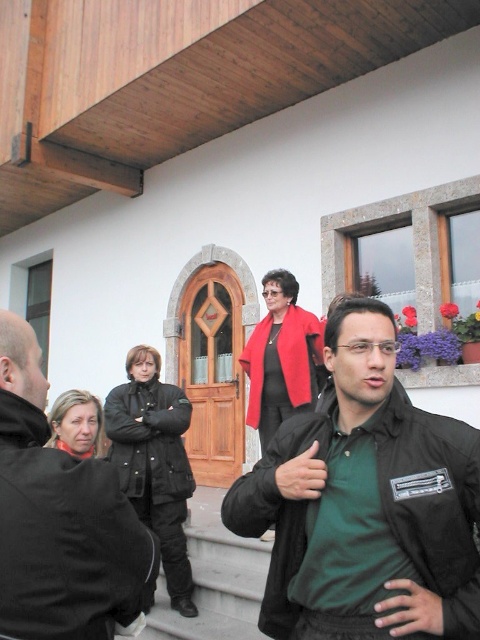
Which is in front, point (20, 449) or point (277, 365)?

Point (20, 449) is more forward.

Does point (12, 380) come closer to viewer compared to point (285, 387)?

Yes, point (12, 380) is in front of point (285, 387).

You are a GUI agent. You are given a task and a screenshot of the screen. Output one action in this format:
    pyautogui.click(x=<x>, y=<y>)
    Task: Click on the dark green fabric jacket at lower right
    The height and width of the screenshot is (640, 480).
    Given the screenshot: What is the action you would take?
    60,516

This screenshot has height=640, width=480. I want to click on dark green fabric jacket at lower right, so (x=60, y=516).

From the picture: Is dark green fabric jacket at lower right thinner than dark green textured jacket at center?

Indeed, dark green fabric jacket at lower right has a lesser width compared to dark green textured jacket at center.

Between point (124, 536) and point (164, 486), which one is positioned in front?

Point (124, 536) is in front.

This screenshot has width=480, height=640. I want to click on dark green fabric jacket at lower right, so click(x=60, y=516).

Where is `dark green fabric jacket at lower right`? dark green fabric jacket at lower right is located at coordinates (60, 516).

Image resolution: width=480 pixels, height=640 pixels. What do you see at coordinates (60, 516) in the screenshot? I see `dark green fabric jacket at lower right` at bounding box center [60, 516].

At what (x,y) coordinates should I click in order to perform the action: click on dark green fabric jacket at lower right. Please return your answer as a coordinate pair (x, y). This screenshot has width=480, height=640. Looking at the image, I should click on (60, 516).